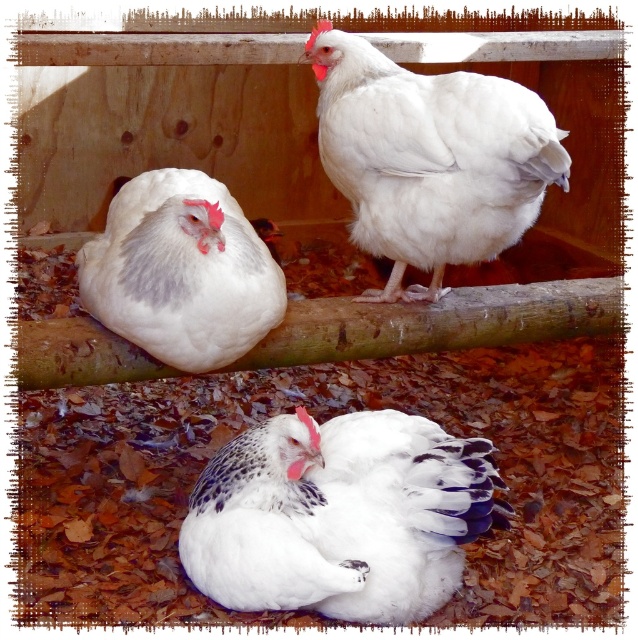
You are a farmer checking the coop. You see the white feathered chicken at center and the white fluffy chicken at upper center. Which chicken is wider?

The white feathered chicken at center is wider than the white fluffy chicken at upper center.

You are a farmer checking the coop and need to reach the white fluffy chicken at upper center and the white fluffy chicken at upper left. Which chicken will you need to reach first if you approach from the front of the coop?

You will need to reach the white fluffy chicken at upper center first because it is closer to you than the white fluffy chicken at upper left, which is further away.

You are standing in the coop and want to take a photo of the white feathered chicken at center. If your camera has a minimum focus distance of 5 feet, will you be able to take a clear photo?

The white feathered chicken at center and camera are 5.30 feet apart, so the camera can focus on it since 5.30 feet is greater than the minimum focus distance of 5 feet.